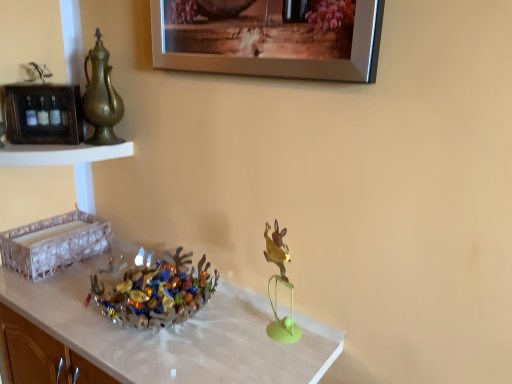
The height and width of the screenshot is (384, 512). I want to click on vacant point to the left of translucent glass bowl at center, so (62, 297).